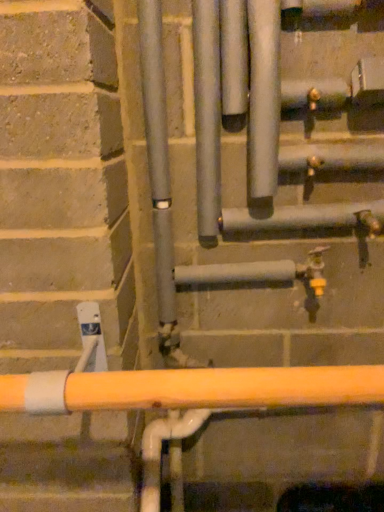
Question: Relative to satin silver pipes at center, which is the second pipe in right-to-left order, is satin silver pipe at upper center, which is the 2th pipe in left-to-right order, in front or behind?

Choices:
 (A) behind
 (B) front

Answer: (B)

Question: Is satin silver pipe at upper center, which is the first pipe from right to left, inside or outside of satin silver pipes at center, which is the second pipe in right-to-left order?

Choices:
 (A) outside
 (B) inside

Answer: (A)

Question: From the image's perspective, is satin silver pipe at upper center, which is the 2th pipe in left-to-right order, located above or below satin silver pipes at center, which is the 1th pipe in left-to-right order?

Choices:
 (A) below
 (B) above

Answer: (B)

Question: Is satin silver pipes at center, which is the 1th pipe in left-to-right order, spatially inside satin silver pipe at upper center, which is the first pipe from right to left, or outside of it?

Choices:
 (A) outside
 (B) inside

Answer: (A)

Question: From a real-world perspective, is satin silver pipes at center, which is the second pipe in right-to-left order, positioned above or below satin silver pipe at upper center, which is the 2th pipe in left-to-right order?

Choices:
 (A) below
 (B) above

Answer: (A)

Question: From their relative heights in the image, would you say satin silver pipes at center, which is the 1th pipe in left-to-right order, is taller or shorter than satin silver pipe at upper center, which is the first pipe from right to left?

Choices:
 (A) tall
 (B) short

Answer: (B)

Question: Considering the relative positions of satin silver pipes at center, which is the second pipe in right-to-left order, and satin silver pipe at upper center, which is the first pipe from right to left, in the image provided, is satin silver pipes at center, which is the second pipe in right-to-left order, to the left or to the right of satin silver pipe at upper center, which is the first pipe from right to left,?

Choices:
 (A) left
 (B) right

Answer: (A)